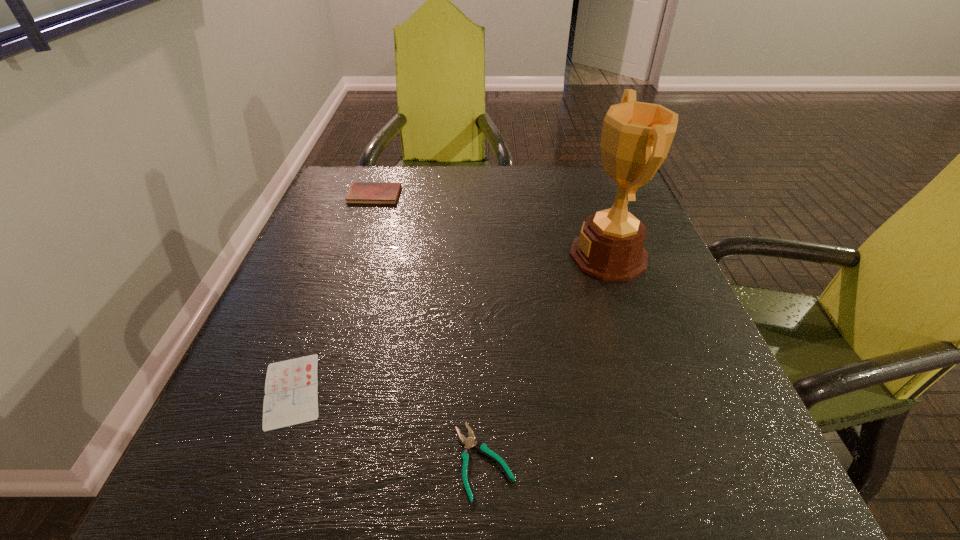
At what (x,y) coordinates should I click in order to perform the action: click on vacant space at the far left corner. Please return your answer as a coordinate pair (x, y). This screenshot has width=960, height=540. Looking at the image, I should click on (356, 167).

The width and height of the screenshot is (960, 540). In order to click on vacant space at the far right corner of the desktop in this screenshot , I will do `click(587, 191)`.

Where is `free spot at the near right corner of the desktop`? Image resolution: width=960 pixels, height=540 pixels. free spot at the near right corner of the desktop is located at coordinates (664, 460).

Where is `unoccupied area between the second object from right to left and the shorter diary`? This screenshot has height=540, width=960. unoccupied area between the second object from right to left and the shorter diary is located at coordinates (388, 426).

Locate an element on the screen. The height and width of the screenshot is (540, 960). free spot between the farthest object and the shorter diary is located at coordinates (333, 293).

Image resolution: width=960 pixels, height=540 pixels. In order to click on free space between the pliers and the award in this screenshot , I will do `click(546, 358)`.

You are a GUI agent. You are given a task and a screenshot of the screen. Output one action in this format:
    pyautogui.click(x=<x>, y=<y>)
    Task: Click on the empty space between the nearer diary and the pliers
    This screenshot has height=540, width=960.
    Given the screenshot: What is the action you would take?
    pyautogui.click(x=388, y=426)

Where is `unoccupied position between the tallest object and the farthest object`? This screenshot has height=540, width=960. unoccupied position between the tallest object and the farthest object is located at coordinates (492, 225).

Identify the location of free spot between the second tallest object and the nearer diary. This screenshot has width=960, height=540. (333, 293).

At what (x,y) coordinates should I click in order to perform the action: click on unoccupied area between the second object from right to left and the rightmost object. Please return your answer as a coordinate pair (x, y). Looking at the image, I should click on (546, 358).